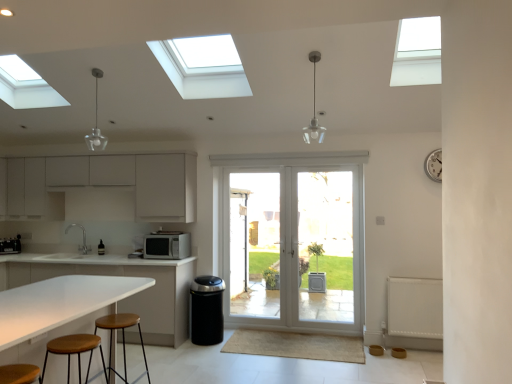
Question: Is clear glass door at center shorter than brown wood stool at lower left, arranged as the 2th stool when viewed from the back?

Choices:
 (A) no
 (B) yes

Answer: (A)

Question: From a real-world perspective, does clear glass door at center stand above brown wood stool at lower left, arranged as the 2th stool when viewed from the back?

Choices:
 (A) yes
 (B) no

Answer: (A)

Question: Is there a large distance between clear glass door at center and brown wood stool at lower left, arranged as the 2th stool when viewed from the back?

Choices:
 (A) yes
 (B) no

Answer: (A)

Question: Considering the relative positions of clear glass door at center and brown wood stool at lower left, arranged as the 2th stool when viewed from the back, in the image provided, is clear glass door at center in front of brown wood stool at lower left, arranged as the 2th stool when viewed from the back,?

Choices:
 (A) yes
 (B) no

Answer: (B)

Question: Is clear glass door at center facing towards brown wood stool at lower left, which ranks as the 1th stool in front-to-back order?

Choices:
 (A) yes
 (B) no

Answer: (A)

Question: Is point (325, 175) closer or farther from the camera than point (417, 279)?

Choices:
 (A) closer
 (B) farther

Answer: (B)

Question: From a real-world perspective, is clear glass door at center physically located above or below white textured radiator at lower right?

Choices:
 (A) above
 (B) below

Answer: (A)

Question: From their relative heights in the image, would you say clear glass door at center is taller or shorter than white textured radiator at lower right?

Choices:
 (A) short
 (B) tall

Answer: (B)

Question: Considering the relative positions of clear glass door at center and white textured radiator at lower right in the image provided, is clear glass door at center to the left or to the right of white textured radiator at lower right?

Choices:
 (A) right
 (B) left

Answer: (B)

Question: Is white matte microwave at center, placed as the 2th appliance when sorted from back to front, to the left or to the right of brown wood stool at lower left, which ranks as the 1th stool in front-to-back order, in the image?

Choices:
 (A) right
 (B) left

Answer: (A)

Question: In terms of width, does white matte microwave at center, the first appliance positioned from the front, look wider or thinner when compared to brown wood stool at lower left, which ranks as the 1th stool in front-to-back order?

Choices:
 (A) wide
 (B) thin

Answer: (A)

Question: Relative to brown wood stool at lower left, which ranks as the 1th stool in front-to-back order, is white matte microwave at center, the first appliance positioned from the front, in front or behind?

Choices:
 (A) front
 (B) behind

Answer: (B)

Question: From a real-world perspective, is white matte microwave at center, the second appliance when ordered from left to right, above or below brown wood stool at lower left, arranged as the 2th stool when viewed from the back?

Choices:
 (A) above
 (B) below

Answer: (A)

Question: Is white matte microwave at center, placed as the 2th appliance when sorted from back to front, to the left or to the right of white metallic clock at upper right in the image?

Choices:
 (A) left
 (B) right

Answer: (A)

Question: From a real-world perspective, is white matte microwave at center, the 1th appliance when ordered from right to left, positioned above or below white metallic clock at upper right?

Choices:
 (A) above
 (B) below

Answer: (B)